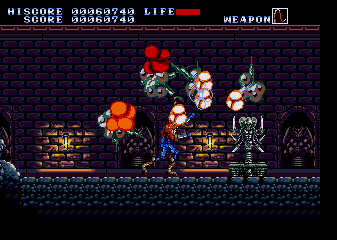
Locate an element on the screen. Image resolution: width=337 pixels, height=240 pixels. statue is located at coordinates (245, 138), (295, 145), (136, 142), (2, 143).